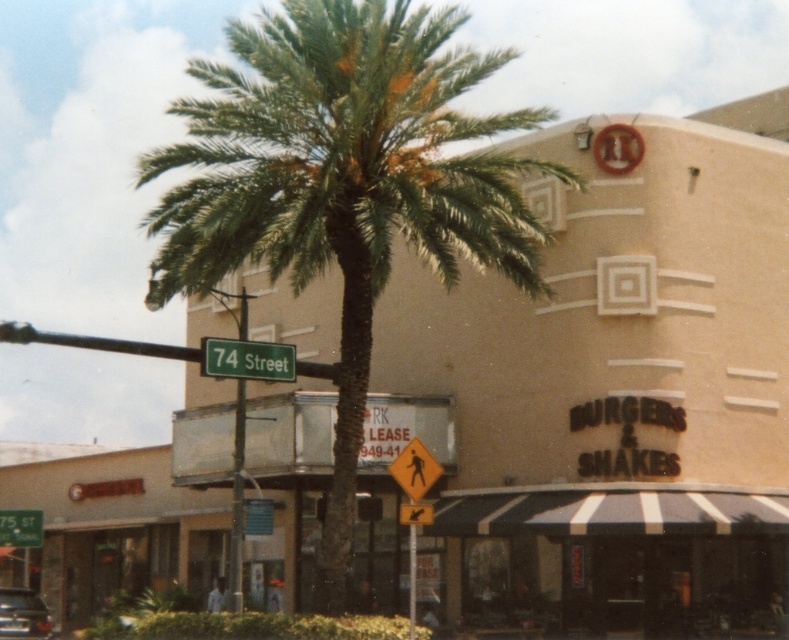
You are standing on the sidewalk and see the black striped awning at lower center and the green plastic street sign at lower left. Which object is closer to you?

The black striped awning at lower center is closer to you because it is in front of the green plastic street sign at lower left.

You are a delivery person with a 20 meter long rope. You need to secure the black striped awning at lower center and the green plastic street sign at lower left. Can you use the rope to connect them without cutting it?

The distance between the black striped awning at lower center and the green plastic street sign at lower left is 19.11 meters, so the 20 meter rope is long enough to connect them without cutting.